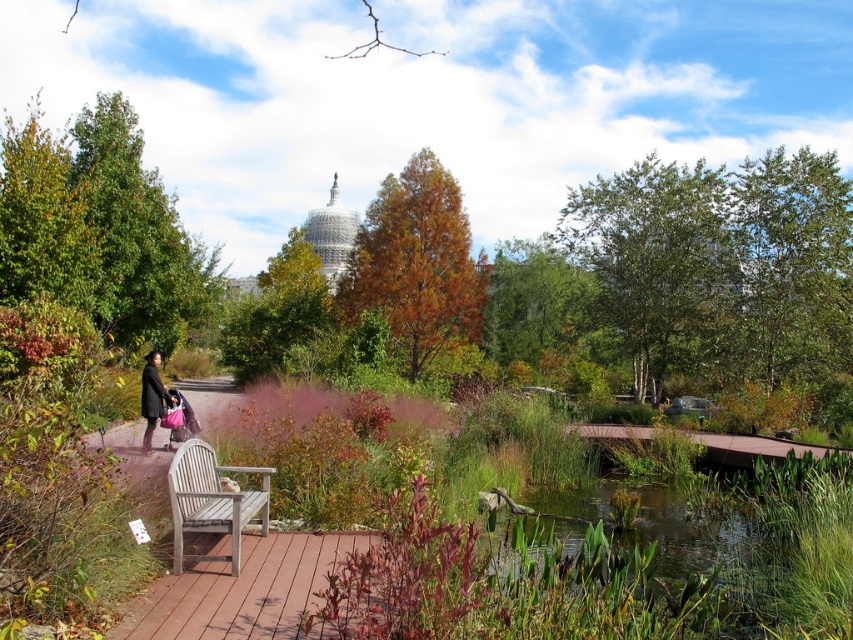
Can you confirm if orange-brown wood tree at center is bigger than wooden bench at center?

Yes, orange-brown wood tree at center is bigger than wooden bench at center.

Does point (442, 250) come farther from viewer compared to point (206, 465)?

That is True.

I want to click on orange-brown wood tree at center, so click(416, 262).

Which is more to the right, green leafy pond at center or green leafy tree at center?

green leafy tree at center is more to the right.

Identify the location of green leafy pond at center. Image resolution: width=853 pixels, height=640 pixels. (666, 528).

The image size is (853, 640). What are the coordinates of `green leafy pond at center` in the screenshot? It's located at (666, 528).

Does point (650, 394) come closer to viewer compared to point (514, 316)?

That is True.

Does green leafy tree at upper right appear over green leafy tree at center?

Correct, green leafy tree at upper right is located above green leafy tree at center.

Is point (717, 291) less distant than point (576, 288)?

Yes, it is.

Find the location of a particular element. green leafy tree at upper right is located at coordinates (657, 262).